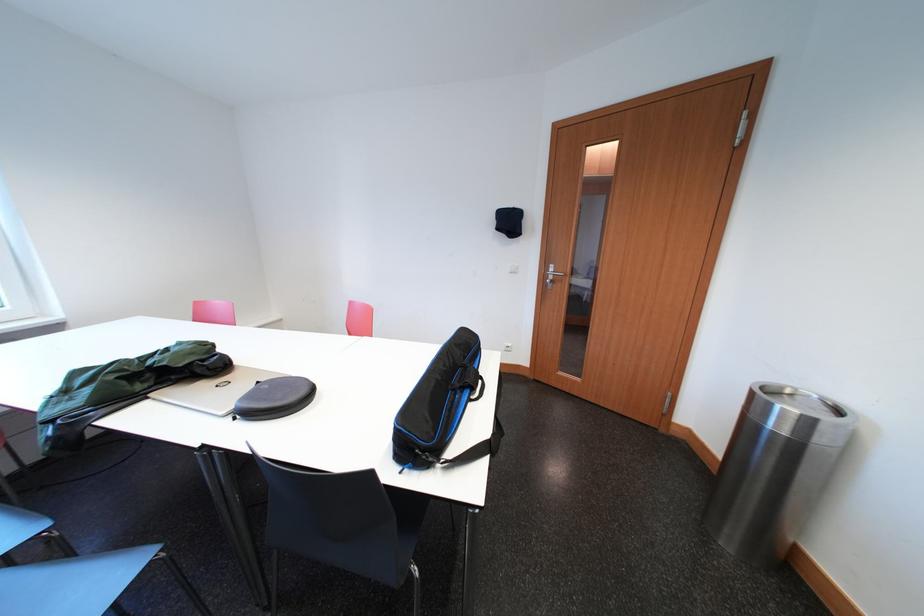
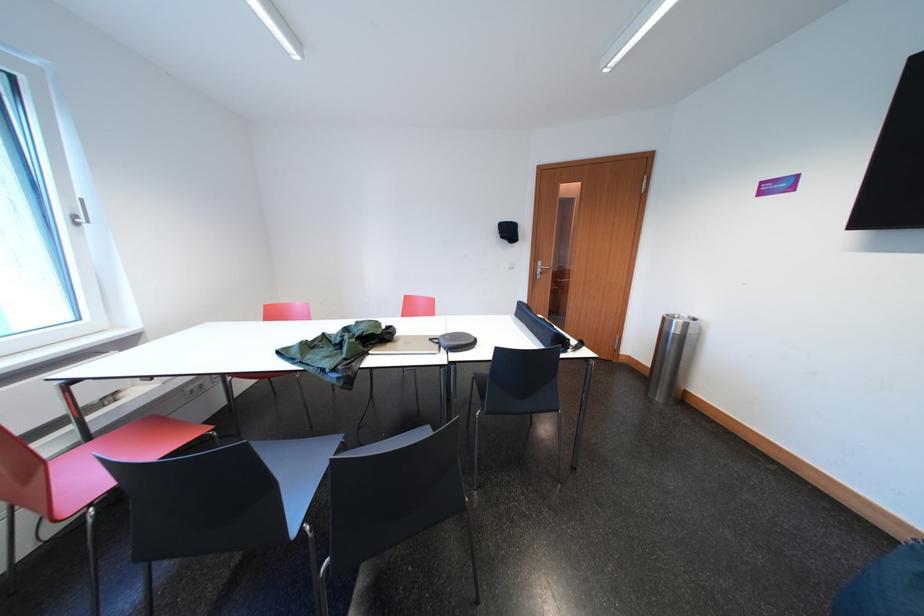
Locate, in the second image, the point that corresponds to (208,375) in the first image.

(395, 341)